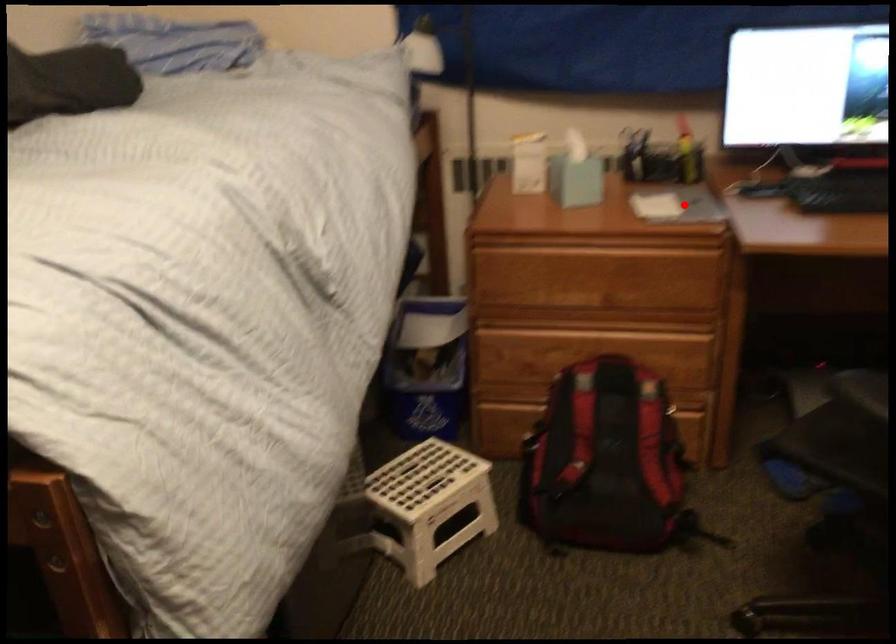
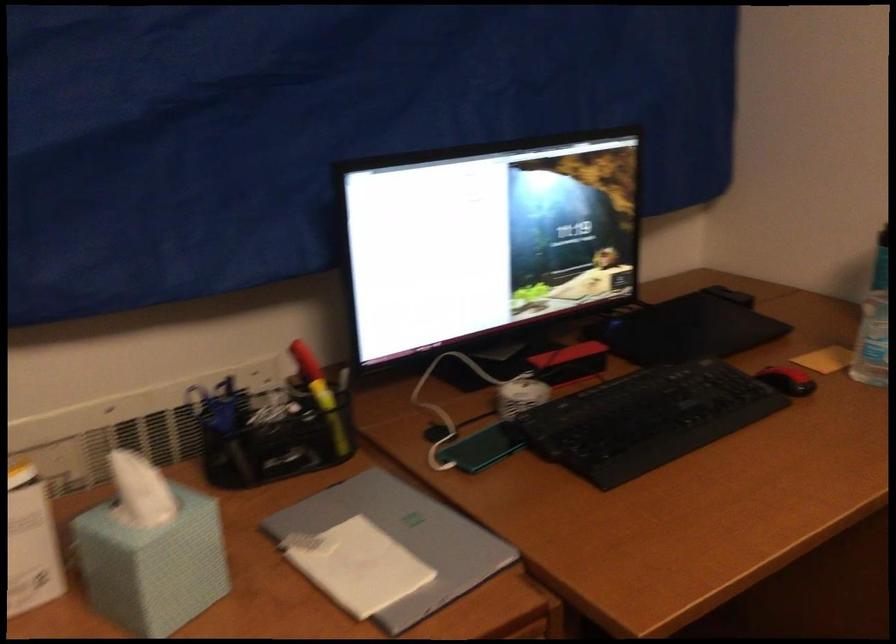
Question: I am providing you with two images of the same scene from different viewpoints. In image1, a red point is highlighted. Considering the same 3D point in image2, which of the following is correct?

Choices:
 (A) It is closer
 (B) It is farther

Answer: (A)